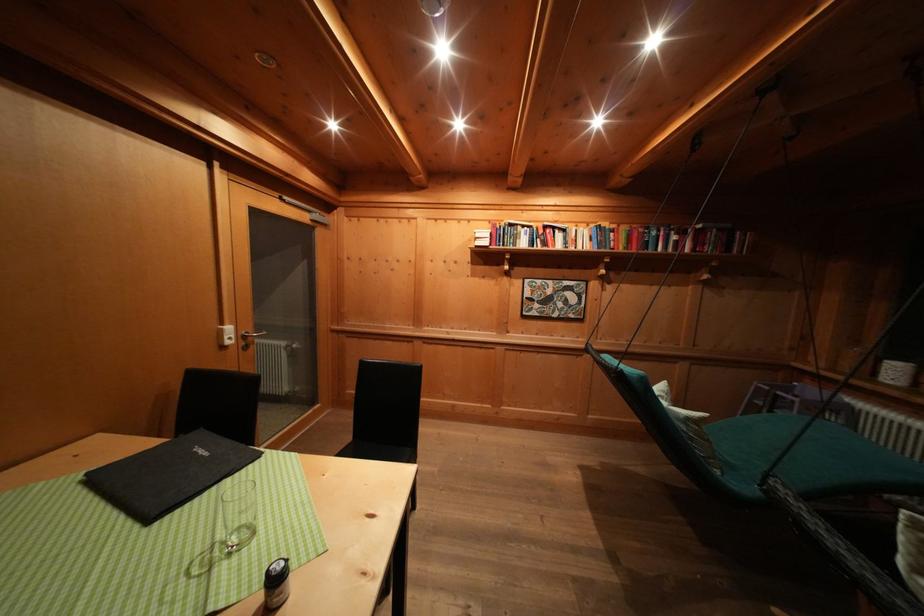
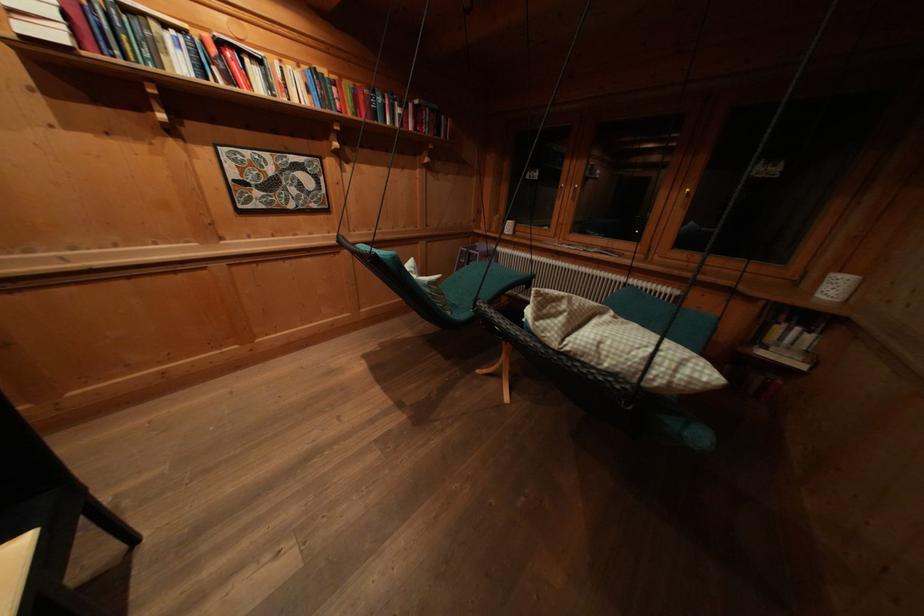
In the second image, find the point that corresponds to point 552,232 in the first image.

(225, 47)